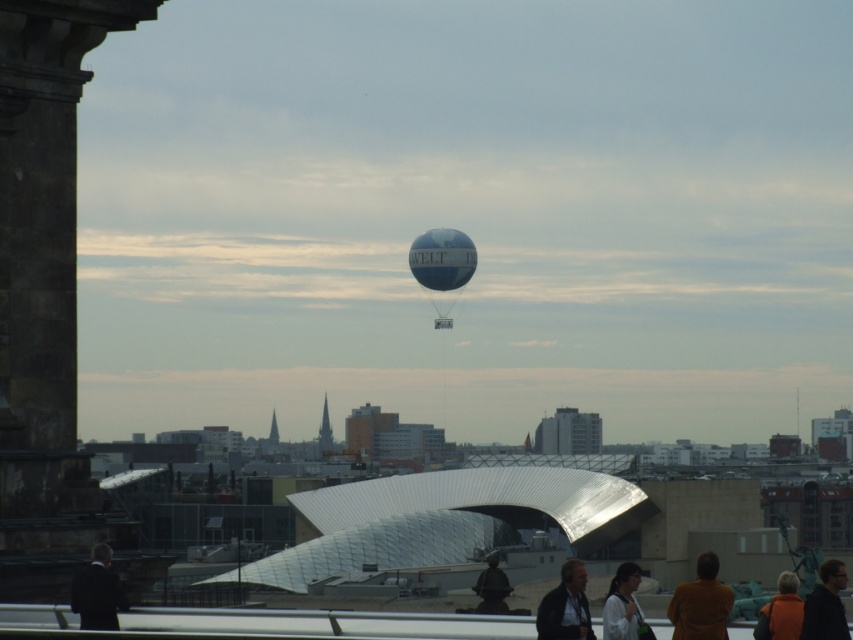
You are standing in the cityscape scene and want to pick up both the brown wool coat at lower right and the dark blue jacket at lower center. Which coat should you pick up first if you want to start from the leftmost item?

The dark blue jacket at lower center should be picked up first because it is positioned to the left of the brown wool coat at lower right.

You are standing in the cityscape scene and want to take a photo of the matte brown statue at center without the brown wool coat at lower right blocking it. How should you position yourself?

Move behind the brown wool coat at lower right so that the matte brown statue at center is visible without obstruction.

In the scene shown: You are standing at the center of the city square and want to pick up the brown wool coat at lower right. Which direction should you move to reach it?

The brown wool coat at lower right is located at point (701,604), so you should move towards the lower right direction from your current position at the center of the city square.